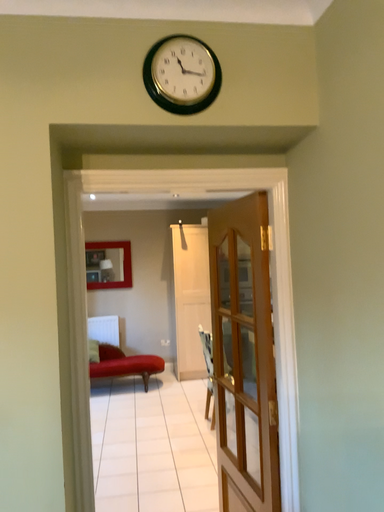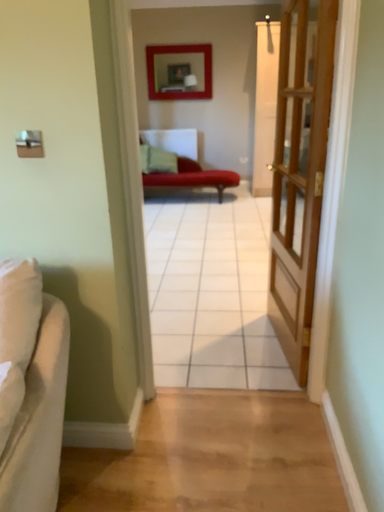
Question: Which way did the camera rotate in the video?

Choices:
 (A) rotated upward
 (B) rotated downward

Answer: (B)